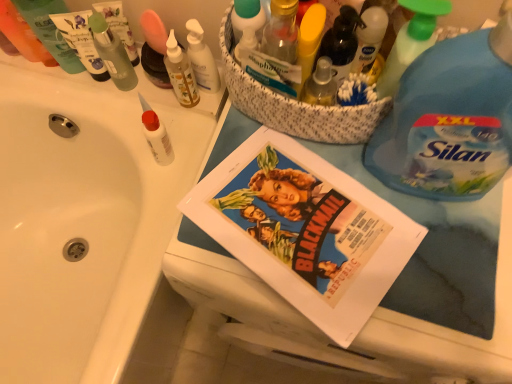
This screenshot has width=512, height=384. In order to click on free space in front of translucent plastic bottle at upper left, which ranks as the 1th toiletry in left-to-right order in this screenshot , I will do `click(34, 87)`.